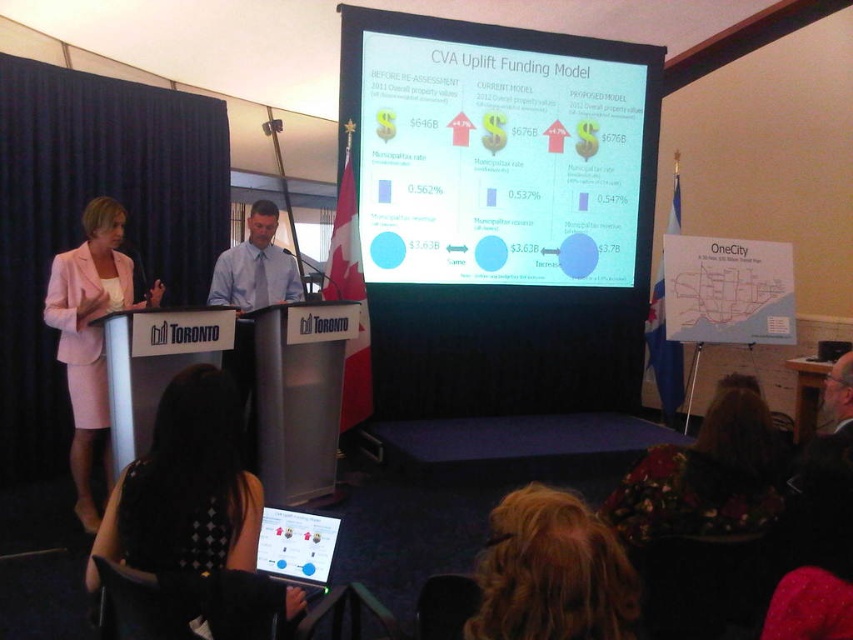
Looking at this image, you are standing in the presentation room and want to touch the point at coordinates point (154,536) on the screen. Can you reach it without moving your position?

The point (154,536) is 5.74 feet away from the viewer, so yes, you can reach it without moving your position since it is within arm reach.

You are a presenter standing in front of the screen showing the funding models. You need to quickly access your notes on the matte plastic tablet at lower center while addressing the audience. However, you are currently holding the black mesh dress at lower center. Can you reach the tablet without letting go of the dress?

The black mesh dress at lower center and matte plastic tablet at lower center are 17.52 inches apart from each other. Since the presenter is holding the dress, they can likely reach the tablet as 17.52 inches is a manageable distance for an average person to extend their arm while maintaining grip on the dress.

You are attending a presentation and need to sit down. You see a black mesh dress at lower center and a pink fabric suit at left. Which one is closer to the seat you want to occupy?

The black mesh dress at lower center is closer to the seat you want to occupy because it is positioned below the pink fabric suit at left, indicating it is lower in the image and likely closer to the viewer.